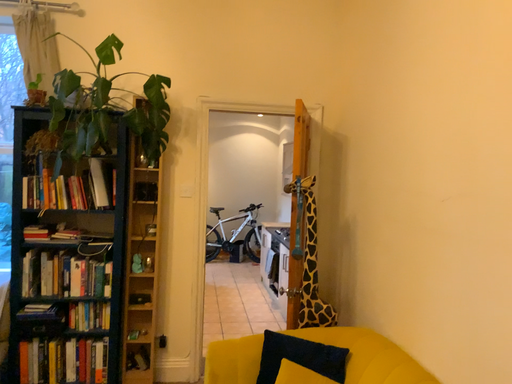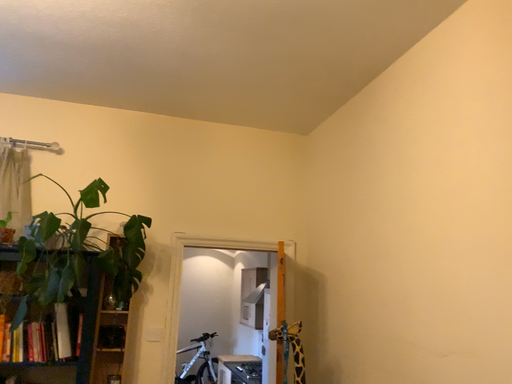
Question: Which way did the camera rotate in the video?

Choices:
 (A) rotated upward
 (B) rotated downward

Answer: (A)